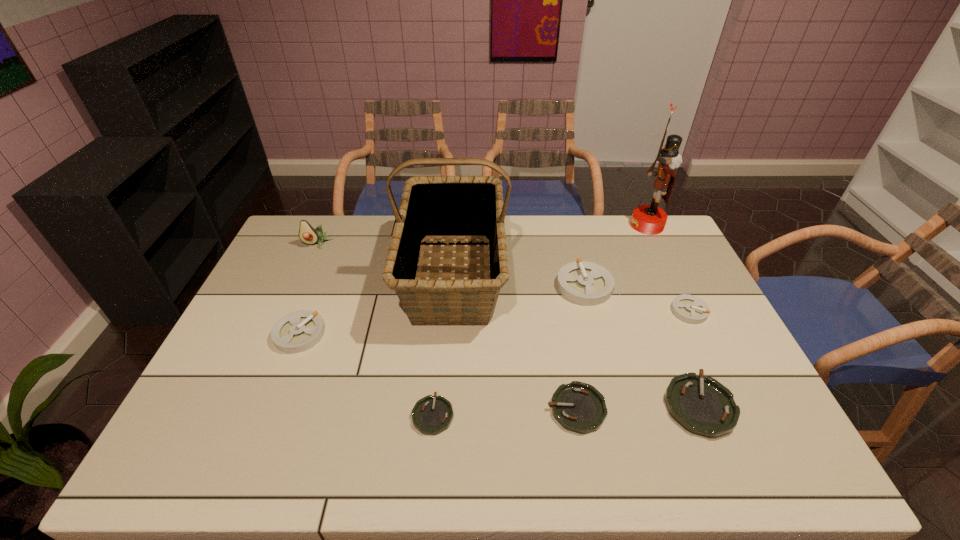
This screenshot has width=960, height=540. Identify the location of free point between the basket and the third tallest object. (385, 260).

Find the location of a particular element. The width and height of the screenshot is (960, 540). unoccupied position between the nutcracker and the rightmost gray ashtray is located at coordinates (668, 268).

Find the location of a particular element. The image size is (960, 540). vacant area that lies between the rightmost gray ashtray and the second gray ashtray from left to right is located at coordinates (636, 299).

This screenshot has width=960, height=540. In order to click on free point between the red nutcracker and the second green ashtray from right to left in this screenshot , I will do `click(612, 317)`.

I want to click on free spot between the rightmost green ashtray and the smallest gray ashtray, so click(694, 358).

Find the location of a particular element. The image size is (960, 540). empty space between the smallest green ashtray and the nutcracker is located at coordinates (540, 320).

Locate an element on the screen. This screenshot has width=960, height=540. free space between the biggest green ashtray and the rightmost gray ashtray is located at coordinates (694, 358).

Identify which object is the sixth nearest to the second green ashtray from left to right. Please provide its 2D coordinates. Your answer should be formatted as a tuple, i.e. [(x, y)], where the tuple contains the x and y coordinates of a point satisfying the conditions above.

[(298, 331)]

You are a GUI agent. You are given a task and a screenshot of the screen. Output one action in this format:
    pyautogui.click(x=<x>, y=<y>)
    Task: Click on the object that is the second closest to the smallest gray ashtray
    This screenshot has width=960, height=540.
    Given the screenshot: What is the action you would take?
    pyautogui.click(x=703, y=406)

Identify which ashtray is located as the third nearest to the avocado. Please provide its 2D coordinates. Your answer should be formatted as a tuple, i.e. [(x, y)], where the tuple contains the x and y coordinates of a point satisfying the conditions above.

[(585, 283)]